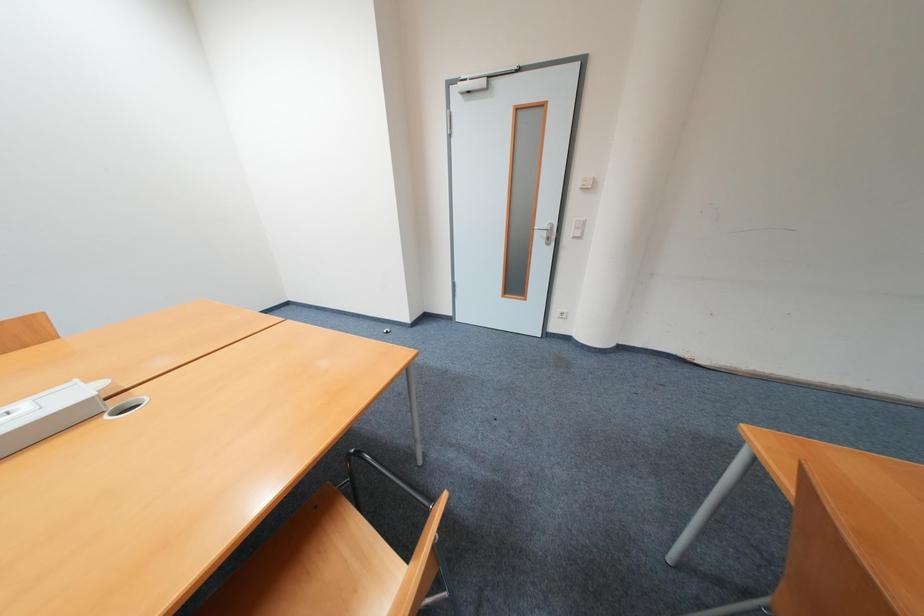
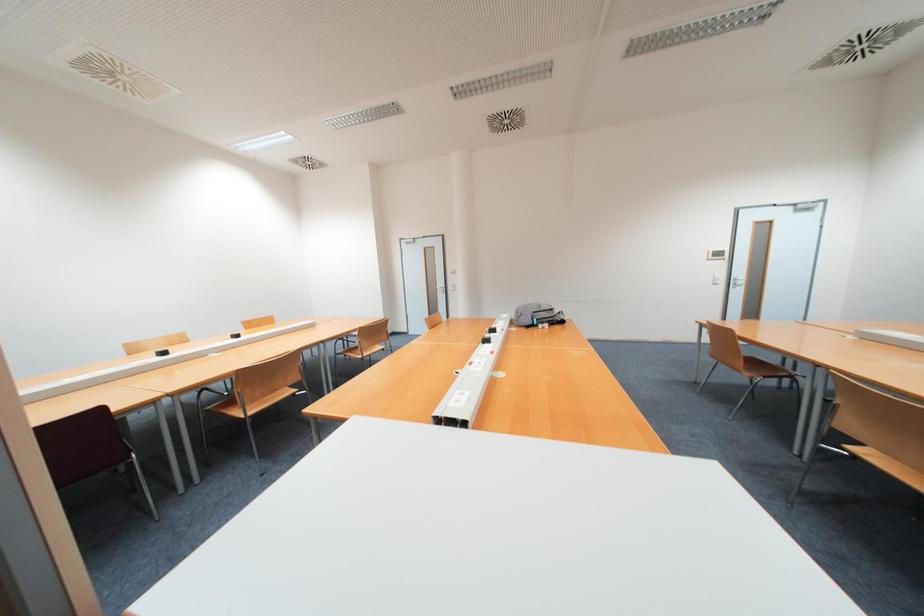
Question: The images are taken continuously from a first-person perspective. In which direction are you moving?

Choices:
 (A) Left
 (B) Right
 (C) Forward
 (D) Backward

Answer: (D)